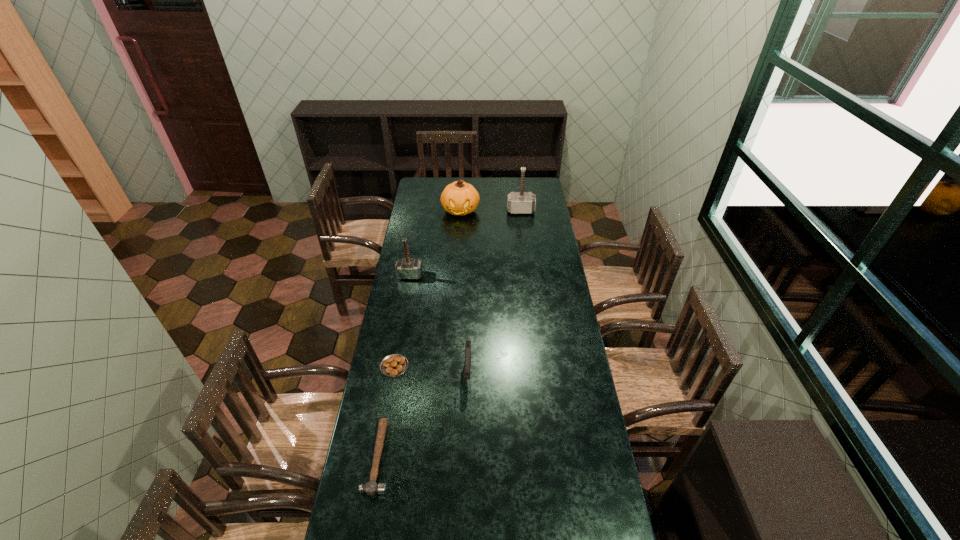
The width and height of the screenshot is (960, 540). Identify the location of unoccupied position between the pumpkin and the third farthest object. [x=435, y=243].

The height and width of the screenshot is (540, 960). Identify the location of vacant point located between the nearest hammer and the third shortest object. (423, 415).

This screenshot has width=960, height=540. I want to click on empty space between the rightmost hammer and the pastry, so click(458, 288).

This screenshot has width=960, height=540. In order to click on vacant space that is in between the pumpkin and the rightmost object in this screenshot , I will do `click(491, 211)`.

Image resolution: width=960 pixels, height=540 pixels. What are the coordinates of `free space between the third farthest object and the pumpkin` in the screenshot? It's located at (435, 243).

Identify the location of vacant space in between the pistol and the nearest hammer. (423, 415).

Where is `vacant area that lies between the fourth nearest object and the pastry`? vacant area that lies between the fourth nearest object and the pastry is located at coordinates (402, 321).

Where is `vacant area between the second shortest hammer and the pumpkin`? vacant area between the second shortest hammer and the pumpkin is located at coordinates (435, 243).

Identify the location of the third closest object to the nearest hammer. This screenshot has width=960, height=540. (406, 268).

Locate an element on the screen. The width and height of the screenshot is (960, 540). the closest object to the second shortest hammer is located at coordinates (458, 198).